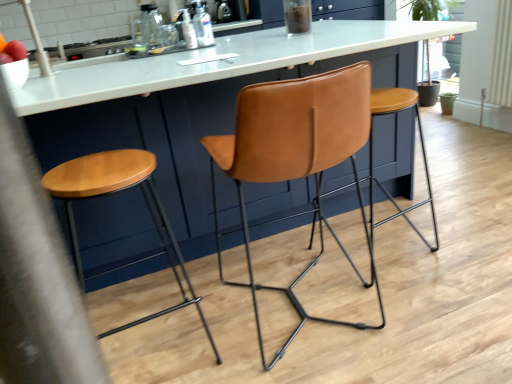
Image resolution: width=512 pixels, height=384 pixels. I want to click on vacant space that's between cognac leather chair at center and leather stool at center, the 1th stool in the right-to-left sequence, so click(386, 282).